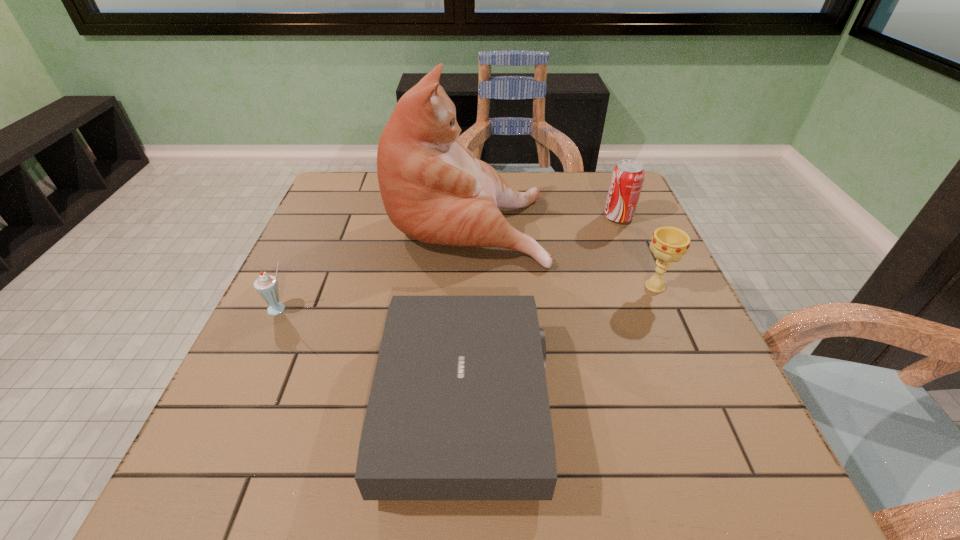
Image resolution: width=960 pixels, height=540 pixels. Identify the location of free space located on the left of the third farthest object. (480, 286).

Image resolution: width=960 pixels, height=540 pixels. In order to click on vacant space located 0.280m on the straw side of the second nearest object in this screenshot , I will do `click(219, 441)`.

What are the coordinates of `free spot located 0.260m on the front-facing side of the projector` in the screenshot? It's located at (692, 404).

This screenshot has width=960, height=540. Identify the location of cat present at the far edge. (434, 189).

You are a GUI agent. You are given a task and a screenshot of the screen. Output one action in this format:
    pyautogui.click(x=<x>, y=<y>)
    Task: Click on the soda can situated at the far edge
    
    Given the screenshot: What is the action you would take?
    pyautogui.click(x=627, y=178)

Where is `object that is at the near edge`? The image size is (960, 540). object that is at the near edge is located at coordinates (458, 409).

This screenshot has height=540, width=960. What are the coordinates of `object present at the left edge` in the screenshot? It's located at (266, 285).

Identify the location of soda can at the right edge. Image resolution: width=960 pixels, height=540 pixels. (627, 178).

Identify the location of chalice that is at the right edge. (669, 244).

The width and height of the screenshot is (960, 540). In order to click on object that is at the far right corner in this screenshot , I will do (627, 178).